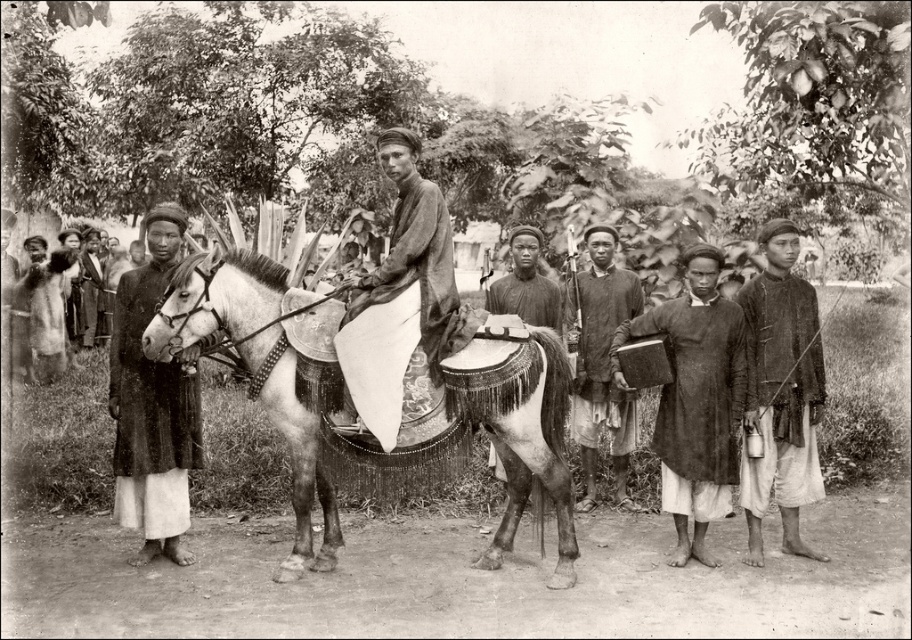
Is smooth white cloth at center wider than dark brown leather jacket at left?

Correct, the width of smooth white cloth at center exceeds that of dark brown leather jacket at left.

Which is behind, point (444, 330) or point (89, 266)?

The point (89, 266) is behind.

Find the location of a particular element. The image size is (912, 640). smooth white cloth at center is located at coordinates (413, 253).

Locate an element on the screen. The width and height of the screenshot is (912, 640). smooth white cloth at center is located at coordinates (413, 253).

Can you confirm if white textured horse at center is positioned below dark brown fabric bag at center?

Yes, white textured horse at center is below dark brown fabric bag at center.

Does white textured horse at center have a greater height compared to dark brown fabric bag at center?

No.

Is point (446, 384) positioned in front of point (658, 413)?

Yes, it is.

The width and height of the screenshot is (912, 640). Identify the location of white textured horse at center. (342, 392).

Can you confirm if white textured horse at center is positioned to the left of dark brown leather book at center?

Yes, white textured horse at center is to the left of dark brown leather book at center.

Measure the distance between white textured horse at center and camera.

white textured horse at center and camera are 5.47 meters apart.

Where is `white textured horse at center`? The width and height of the screenshot is (912, 640). white textured horse at center is located at coordinates (342, 392).